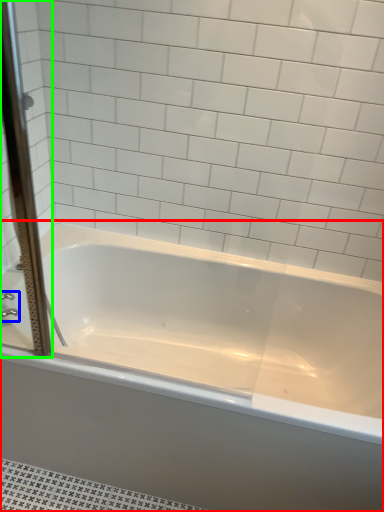
Question: Which object is the farthest from bathtub (highlighted by a red box)? Choose among these: faucet (highlighted by a blue box) or screen door (highlighted by a green box).

Choices:
 (A) faucet
 (B) screen door

Answer: (A)